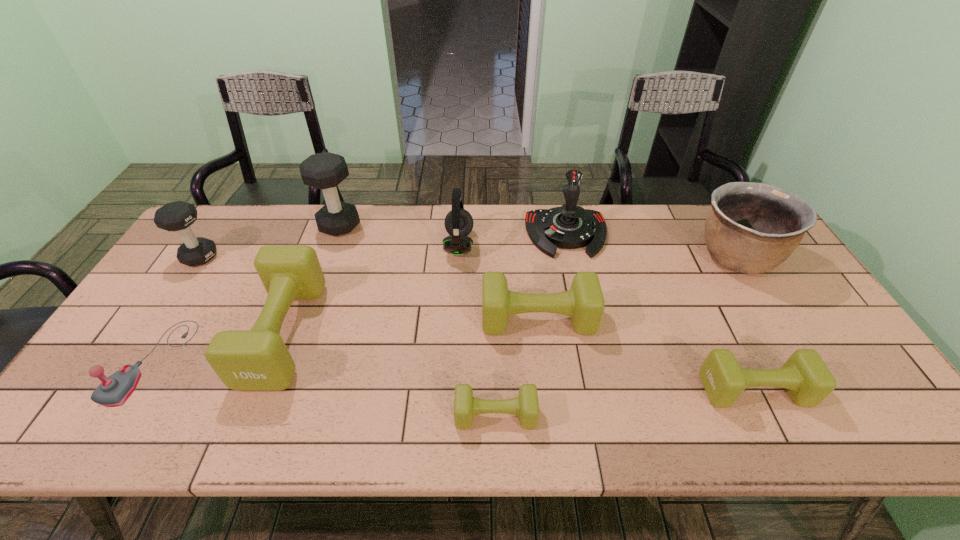
Locate an element on the screen. Image resolution: width=960 pixels, height=540 pixels. the fourth shortest object is located at coordinates (584, 302).

You are a GUI agent. You are given a task and a screenshot of the screen. Output one action in this format:
    pyautogui.click(x=<x>, y=<y>)
    Task: Click on the third shortest dumbbell
    Image resolution: width=960 pixels, height=540 pixels.
    Given the screenshot: What is the action you would take?
    pyautogui.click(x=584, y=302)

Find the location of a particular element. Image resolution: width=960 pixels, height=540 pixels. the second shortest dumbbell is located at coordinates (807, 379).

Find the location of a particular element. the rightmost olive dumbbell is located at coordinates (807, 379).

Find the location of `the left joystick`. the left joystick is located at coordinates (113, 391).

I want to click on the nearer joystick, so click(x=113, y=391).

Identify the location of the shortest dumbbell. Image resolution: width=960 pixels, height=540 pixels. (525, 406).

Where is `the smallest olive dumbbell`? The width and height of the screenshot is (960, 540). the smallest olive dumbbell is located at coordinates (525, 406).

This screenshot has height=540, width=960. Identify the location of vacant space situated 0.180m on the front of the tallest dumbbell. (320, 279).

Locate an element on the screen. This screenshot has width=960, height=540. free space located on the handle side of the right joystick is located at coordinates (576, 278).